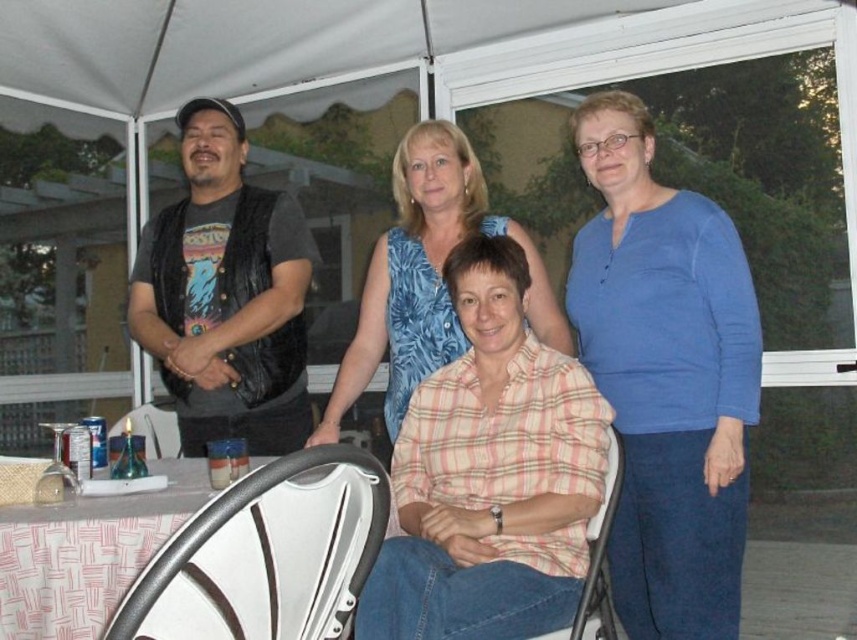
Which of these two, white plastic chair at lower center or white plastic chair at lower left, stands shorter?

white plastic chair at lower left is shorter.

Identify the location of white plastic chair at lower center. The width and height of the screenshot is (857, 640). (597, 561).

You are a GUI agent. You are given a task and a screenshot of the screen. Output one action in this format:
    pyautogui.click(x=<x>, y=<y>)
    Task: Click on the white plastic chair at lower center
    The height and width of the screenshot is (640, 857).
    Given the screenshot: What is the action you would take?
    tap(597, 561)

Between pink plaid shirt at center and blue cotton shirt at right, which one appears on the left side from the viewer's perspective?

pink plaid shirt at center is more to the left.

The height and width of the screenshot is (640, 857). What are the coordinates of `pink plaid shirt at center` in the screenshot? It's located at (667, 376).

You are a GUI agent. You are given a task and a screenshot of the screen. Output one action in this format:
    pyautogui.click(x=<x>, y=<y>)
    Task: Click on the pink plaid shirt at center
    
    Given the screenshot: What is the action you would take?
    pyautogui.click(x=667, y=376)

Is white fabric table at lower left thinner than white plastic chair at lower center?

No, white fabric table at lower left is not thinner than white plastic chair at lower center.

Who is lower down, white fabric table at lower left or white plastic chair at lower center?

white plastic chair at lower center is below.

I want to click on white fabric table at lower left, so click(x=85, y=556).